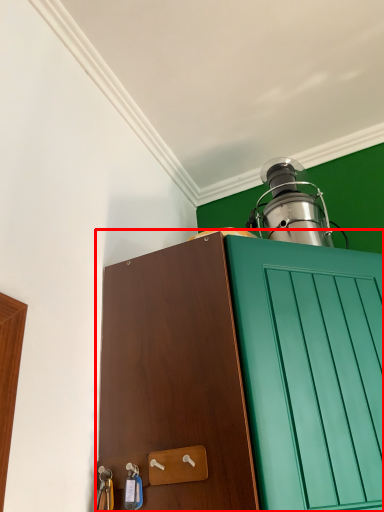
Question: Observing the image, what is the correct spatial positioning of cabinetry (annotated by the red box) in reference to oil lamp?

Choices:
 (A) left
 (B) right

Answer: (A)